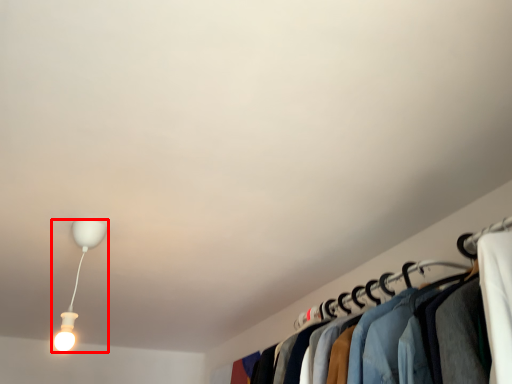
Question: Where is lamp (annotated by the red box) located in relation to closet in the image?

Choices:
 (A) left
 (B) right

Answer: (A)